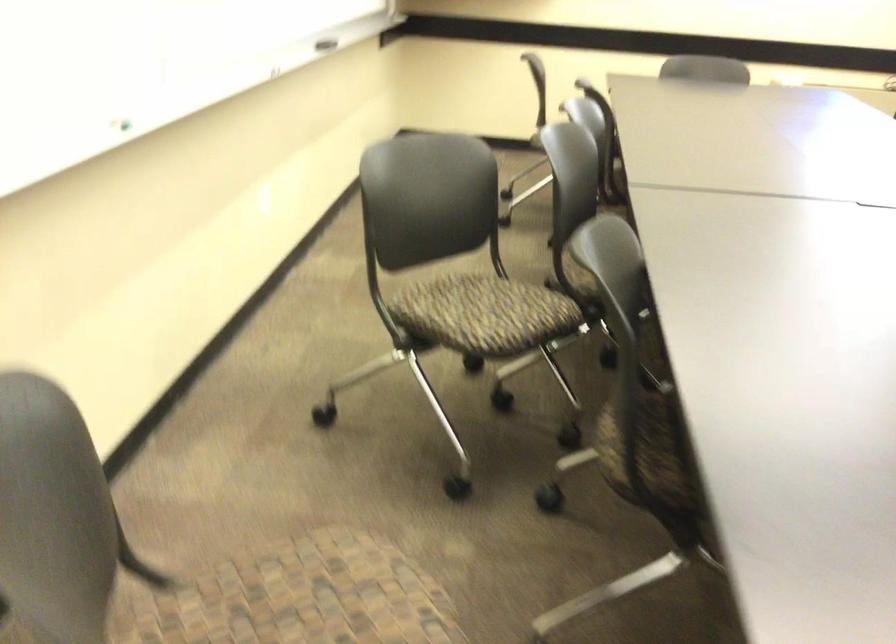
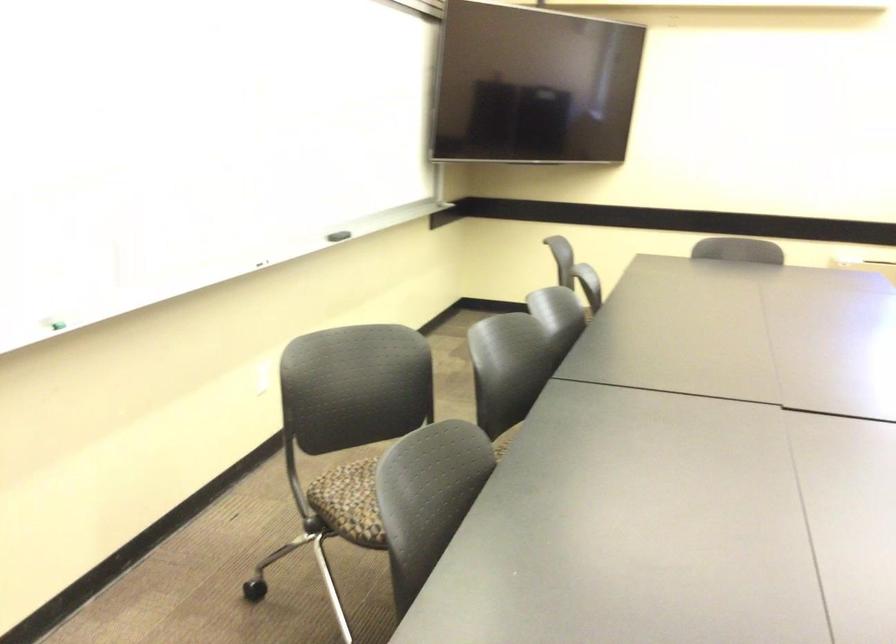
In the second image, find the point that corresponds to [116,133] in the first image.

(55, 325)